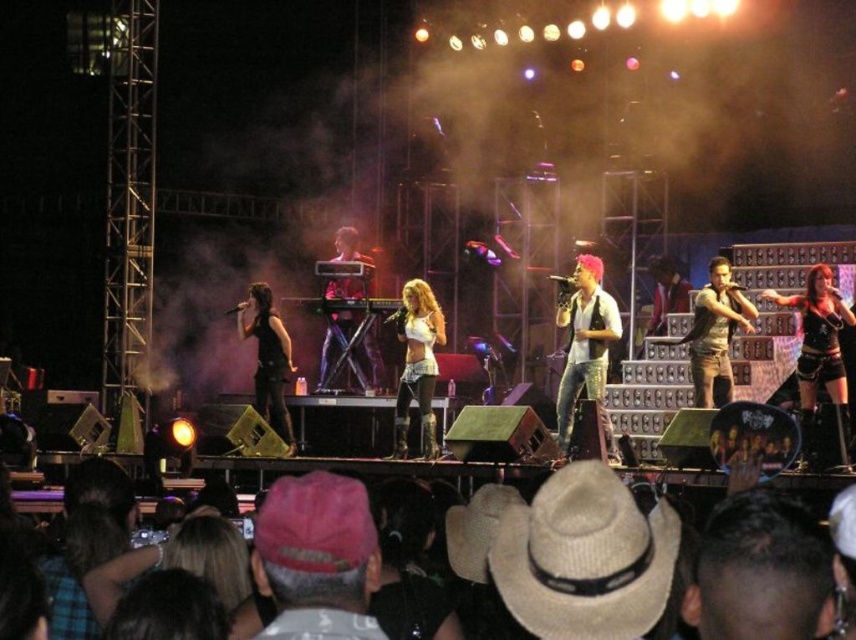
Is dark brown hair at upper right closer to camera compared to black leather pants at center?

Yes, dark brown hair at upper right is in front of black leather pants at center.

Does dark brown hair at upper right have a greater height compared to black leather pants at center?

No.

Where is `dark brown hair at upper right`? dark brown hair at upper right is located at coordinates (761, 572).

At what (x,y) coordinates should I click in order to perform the action: click on dark brown hair at upper right. Please return your answer as a coordinate pair (x, y). Image resolution: width=856 pixels, height=640 pixels. Looking at the image, I should click on (761, 572).

Which is more to the right, pink sequined shirt at center or white leather boots at center?

Positioned to the right is pink sequined shirt at center.

Does pink sequined shirt at center have a lesser width compared to white leather boots at center?

In fact, pink sequined shirt at center might be wider than white leather boots at center.

Does point (596, 352) come closer to viewer compared to point (431, 448)?

No, (596, 352) is behind (431, 448).

Where is `pink sequined shirt at center`? The image size is (856, 640). pink sequined shirt at center is located at coordinates (586, 346).

Is white leather boots at center taller than shiny black keyboard at center?

Incorrect, white leather boots at center's height is not larger of shiny black keyboard at center's.

Is white leather boots at center behind shiny black keyboard at center?

No, white leather boots at center is closer to the viewer.

You are a GUI agent. You are given a task and a screenshot of the screen. Output one action in this format:
    pyautogui.click(x=<x>, y=<y>)
    Task: Click on the white leather boots at center
    
    Given the screenshot: What is the action you would take?
    pyautogui.click(x=417, y=364)

Locate an element on the screen. white leather boots at center is located at coordinates (417, 364).